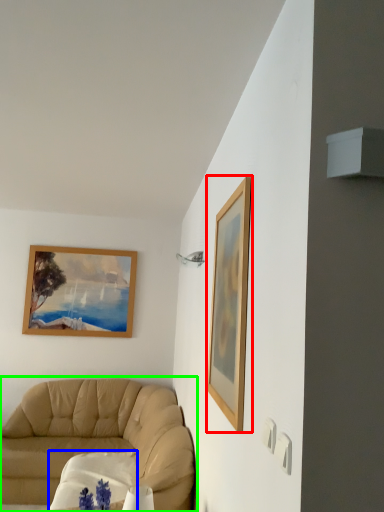
Question: Which object is the closest to the picture frame (highlighted by a red box)? Choose among these: round table (highlighted by a blue box) or studio couch (highlighted by a green box).

Choices:
 (A) round table
 (B) studio couch

Answer: (A)